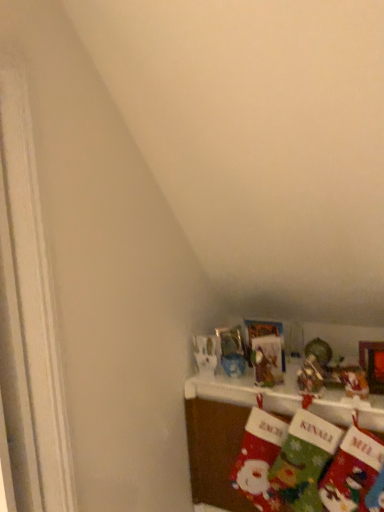
The height and width of the screenshot is (512, 384). Describe the element at coordinates (304, 461) in the screenshot. I see `red felt stocking at lower right, the 2th sock from the right` at that location.

The image size is (384, 512). What do you see at coordinates (226, 431) in the screenshot?
I see `velvet christmas stockings at lower right` at bounding box center [226, 431].

Image resolution: width=384 pixels, height=512 pixels. What do you see at coordinates (259, 459) in the screenshot?
I see `red felt stocking at lower right, acting as the 3th sock starting from the right` at bounding box center [259, 459].

In order to face shiny metallic ornament at upper right, the 2th toy in the left-to-right sequence, should I rotate leftwards or rightwards?

To face it directly, rotate right by 20.957 degrees.

The image size is (384, 512). Find the location of `green felt stocking at lower right, the first sock in the right-to-left sequence`. green felt stocking at lower right, the first sock in the right-to-left sequence is located at coordinates (352, 472).

The image size is (384, 512). Find the location of `red felt stocking at lower right, placed as the 2th sock when sorted from left to right`. red felt stocking at lower right, placed as the 2th sock when sorted from left to right is located at coordinates (304, 461).

Which of these two, metallic silver ornament at upper center, the 2th toy from the right, or shiny metallic ornament at upper right, the 2th toy in the left-to-right sequence, stands taller?

With more height is metallic silver ornament at upper center, the 2th toy from the right.

From a real-world perspective, is metallic silver ornament at upper center, the 1th toy in the left-to-right sequence, physically above shiny metallic ornament at upper right, the 2th toy in the left-to-right sequence?

Incorrect, from a real-world perspective, metallic silver ornament at upper center, the 1th toy in the left-to-right sequence, is lower than shiny metallic ornament at upper right, the 2th toy in the left-to-right sequence.

Is metallic silver ornament at upper center, the 1th toy in the left-to-right sequence, oriented towards shiny metallic ornament at upper right, the 2th toy in the left-to-right sequence?

No, metallic silver ornament at upper center, the 1th toy in the left-to-right sequence, is not oriented towards shiny metallic ornament at upper right, the 2th toy in the left-to-right sequence.

Which object is more forward, metallic silver ornament at upper center, the 1th toy in the left-to-right sequence, or shiny metallic ornament at upper right, the 2th toy in the left-to-right sequence?

shiny metallic ornament at upper right, the 2th toy in the left-to-right sequence.

Can you confirm if green felt stocking at lower right, placed as the 3th sock when sorted from left to right, is smaller than red felt stocking at lower right, acting as the 3th sock starting from the right?

Indeed, green felt stocking at lower right, placed as the 3th sock when sorted from left to right, has a smaller size compared to red felt stocking at lower right, acting as the 3th sock starting from the right.

Is green felt stocking at lower right, placed as the 3th sock when sorted from left to right, inside the boundaries of red felt stocking at lower right, acting as the 3th sock starting from the right, or outside?

green felt stocking at lower right, placed as the 3th sock when sorted from left to right, is not inside red felt stocking at lower right, acting as the 3th sock starting from the right, it's outside.

Can you confirm if green felt stocking at lower right, placed as the 3th sock when sorted from left to right, is positioned to the right of red felt stocking at lower right, acting as the 1th sock starting from the left?

Indeed, green felt stocking at lower right, placed as the 3th sock when sorted from left to right, is positioned on the right side of red felt stocking at lower right, acting as the 1th sock starting from the left.

Is green felt stocking at lower right, placed as the 3th sock when sorted from left to right, further to the viewer compared to red felt stocking at lower right, acting as the 3th sock starting from the right?

No, it is in front of red felt stocking at lower right, acting as the 3th sock starting from the right.

From the picture: Is green felt stocking at lower right, the first sock in the right-to-left sequence, surrounding red felt stocking at lower right, placed as the 2th sock when sorted from left to right?

Yes, red felt stocking at lower right, placed as the 2th sock when sorted from left to right, is surrounded by green felt stocking at lower right, the first sock in the right-to-left sequence.

Is green felt stocking at lower right, placed as the 3th sock when sorted from left to right, taller than red felt stocking at lower right, placed as the 2th sock when sorted from left to right?

No, green felt stocking at lower right, placed as the 3th sock when sorted from left to right, is not taller than red felt stocking at lower right, placed as the 2th sock when sorted from left to right.

From the image's perspective, is green felt stocking at lower right, the first sock in the right-to-left sequence, positioned above or below red felt stocking at lower right, placed as the 2th sock when sorted from left to right?

green felt stocking at lower right, the first sock in the right-to-left sequence, is situated lower than red felt stocking at lower right, placed as the 2th sock when sorted from left to right, in the image.

Is metallic silver ornament at upper center, the 2th toy from the right, beside red felt stocking at lower right, the 2th sock from the right?

No, metallic silver ornament at upper center, the 2th toy from the right, is not in contact with red felt stocking at lower right, the 2th sock from the right.

Which object is closer to the camera, metallic silver ornament at upper center, the 2th toy from the right, or red felt stocking at lower right, placed as the 2th sock when sorted from left to right?

Positioned in front is red felt stocking at lower right, placed as the 2th sock when sorted from left to right.

Considering the positions of objects metallic silver ornament at upper center, the 1th toy in the left-to-right sequence, and red felt stocking at lower right, the 2th sock from the right, in the image provided, who is more to the right, metallic silver ornament at upper center, the 1th toy in the left-to-right sequence, or red felt stocking at lower right, the 2th sock from the right,?

metallic silver ornament at upper center, the 1th toy in the left-to-right sequence, is more to the right.

From the image's perspective, relative to red felt stocking at lower right, acting as the 1th sock starting from the left, is red felt stocking at lower right, the 2th sock from the right, above or below?

Based on their image positions, red felt stocking at lower right, the 2th sock from the right, is located above red felt stocking at lower right, acting as the 1th sock starting from the left.

Does red felt stocking at lower right, the 2th sock from the right, have a greater height compared to red felt stocking at lower right, acting as the 3th sock starting from the right?

Indeed, red felt stocking at lower right, the 2th sock from the right, has a greater height compared to red felt stocking at lower right, acting as the 3th sock starting from the right.

From a real-world perspective, which is physically below, red felt stocking at lower right, the 2th sock from the right, or red felt stocking at lower right, acting as the 3th sock starting from the right?

In real-world perspective, red felt stocking at lower right, acting as the 3th sock starting from the right, is lower.

Which object is wider, red felt stocking at lower right, placed as the 2th sock when sorted from left to right, or red felt stocking at lower right, acting as the 3th sock starting from the right?

red felt stocking at lower right, placed as the 2th sock when sorted from left to right, is wider.

Would you say red felt stocking at lower right, the 2th sock from the right, is inside or outside metallic silver ornament at upper center, the 2th toy from the right?

red felt stocking at lower right, the 2th sock from the right, is not inside metallic silver ornament at upper center, the 2th toy from the right, it's outside.

Can you confirm if red felt stocking at lower right, the 2th sock from the right, is smaller than metallic silver ornament at upper center, the 2th toy from the right?

Incorrect, red felt stocking at lower right, the 2th sock from the right, is not smaller in size than metallic silver ornament at upper center, the 2th toy from the right.

From the image's perspective, is red felt stocking at lower right, the 2th sock from the right, positioned above or below metallic silver ornament at upper center, the 1th toy in the left-to-right sequence?

Clearly, from the image's perspective, red felt stocking at lower right, the 2th sock from the right, is below metallic silver ornament at upper center, the 1th toy in the left-to-right sequence.

Considering the sizes of red felt stocking at lower right, the 2th sock from the right, and metallic silver ornament at upper center, the 2th toy from the right, in the image, is red felt stocking at lower right, the 2th sock from the right, wider or thinner than metallic silver ornament at upper center, the 2th toy from the right,?

red felt stocking at lower right, the 2th sock from the right, is wider than metallic silver ornament at upper center, the 2th toy from the right.

Can you confirm if green felt stocking at lower right, the first sock in the right-to-left sequence, is bigger than metallic silver ornament at upper center, the 1th toy in the left-to-right sequence?

Correct, green felt stocking at lower right, the first sock in the right-to-left sequence, is larger in size than metallic silver ornament at upper center, the 1th toy in the left-to-right sequence.

Consider the image. Between green felt stocking at lower right, placed as the 3th sock when sorted from left to right, and metallic silver ornament at upper center, the 2th toy from the right, which one has larger width?

green felt stocking at lower right, placed as the 3th sock when sorted from left to right, is wider.

Based on the photo, how different are the orientations of green felt stocking at lower right, placed as the 3th sock when sorted from left to right, and metallic silver ornament at upper center, the 2th toy from the right, in degrees?

There is a 5.93-degree angle between the facing directions of green felt stocking at lower right, placed as the 3th sock when sorted from left to right, and metallic silver ornament at upper center, the 2th toy from the right.

Do you think green felt stocking at lower right, the first sock in the right-to-left sequence, is within metallic silver ornament at upper center, the 2th toy from the right, or outside of it?

green felt stocking at lower right, the first sock in the right-to-left sequence, cannot be found inside metallic silver ornament at upper center, the 2th toy from the right.

In order to click on toy that is behind the shiny metallic ornament at upper right, which is the 1th toy from right to left in this screenshot , I will do `click(310, 378)`.

In order to click on the 1st sock located above the red felt stocking at lower right, acting as the 3th sock starting from the right (from a real-world perspective) in this screenshot , I will do `click(352, 472)`.

Looking at the image, which one is located further to red felt stocking at lower right, placed as the 2th sock when sorted from left to right, shiny metallic ornament at upper right, which is the 1th toy from right to left, or velvet christmas stockings at lower right?

shiny metallic ornament at upper right, which is the 1th toy from right to left, is further to red felt stocking at lower right, placed as the 2th sock when sorted from left to right.

Which object lies further to the anchor point shiny metallic ornament at upper right, which is the 1th toy from right to left, velvet christmas stockings at lower right or red felt stocking at lower right, placed as the 2th sock when sorted from left to right?

Based on the image, velvet christmas stockings at lower right appears to be further to shiny metallic ornament at upper right, which is the 1th toy from right to left.

Which object lies nearer to the anchor point red felt stocking at lower right, acting as the 1th sock starting from the left, metallic silver ornament at upper center, the 2th toy from the right, or green felt stocking at lower right, placed as the 3th sock when sorted from left to right?

Based on the image, green felt stocking at lower right, placed as the 3th sock when sorted from left to right, appears to be nearer to red felt stocking at lower right, acting as the 1th sock starting from the left.

Looking at this image, from the image, which object appears to be nearer to velvet christmas stockings at lower right, red felt stocking at lower right, placed as the 2th sock when sorted from left to right, or red felt stocking at lower right, acting as the 1th sock starting from the left?

red felt stocking at lower right, acting as the 1th sock starting from the left.

Based on their spatial positions, is velvet christmas stockings at lower right or red felt stocking at lower right, acting as the 3th sock starting from the right, further from green felt stocking at lower right, placed as the 3th sock when sorted from left to right?

The object further to green felt stocking at lower right, placed as the 3th sock when sorted from left to right, is velvet christmas stockings at lower right.

From the image, which object appears to be nearer to green felt stocking at lower right, the first sock in the right-to-left sequence, velvet christmas stockings at lower right or metallic silver ornament at upper center, the 1th toy in the left-to-right sequence?

metallic silver ornament at upper center, the 1th toy in the left-to-right sequence, lies closer to green felt stocking at lower right, the first sock in the right-to-left sequence, than the other object.

Which object lies further to the anchor point green felt stocking at lower right, the first sock in the right-to-left sequence, red felt stocking at lower right, acting as the 1th sock starting from the left, or red felt stocking at lower right, the 2th sock from the right?

red felt stocking at lower right, acting as the 1th sock starting from the left, lies further to green felt stocking at lower right, the first sock in the right-to-left sequence, than the other object.

Looking at the image, which one is located closer to red felt stocking at lower right, acting as the 3th sock starting from the right, metallic silver ornament at upper center, the 1th toy in the left-to-right sequence, or red felt stocking at lower right, placed as the 2th sock when sorted from left to right?

red felt stocking at lower right, placed as the 2th sock when sorted from left to right, is closer to red felt stocking at lower right, acting as the 3th sock starting from the right.

The width and height of the screenshot is (384, 512). What are the coordinates of `shelf between red felt stocking at lower right, acting as the 3th sock starting from the right, and green felt stocking at lower right, placed as the 3th sock when sorted from left to right, in the horizontal direction` in the screenshot? It's located at (226, 431).

Locate an element on the screen. Image resolution: width=384 pixels, height=512 pixels. toy between shiny metallic ornament at upper right, which is the 1th toy from right to left, and red felt stocking at lower right, placed as the 2th sock when sorted from left to right, vertically is located at coordinates (310, 378).

Where is `sock between red felt stocking at lower right, acting as the 3th sock starting from the right, and velvet christmas stockings at lower right, in the horizontal direction`? The height and width of the screenshot is (512, 384). sock between red felt stocking at lower right, acting as the 3th sock starting from the right, and velvet christmas stockings at lower right, in the horizontal direction is located at coordinates (304, 461).

Where is `toy between shiny metallic ornament at upper right, the 2th toy in the left-to-right sequence, and velvet christmas stockings at lower right in the up-down direction`? Image resolution: width=384 pixels, height=512 pixels. toy between shiny metallic ornament at upper right, the 2th toy in the left-to-right sequence, and velvet christmas stockings at lower right in the up-down direction is located at coordinates (310, 378).